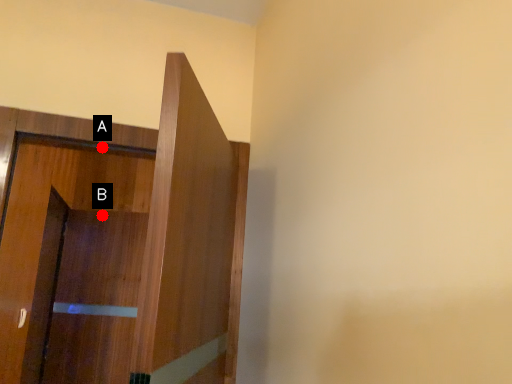
Question: Two points are circled on the image, labeled by A and B beside each circle. Which of the following is the farthest from the observer?

Choices:
 (A) A is further
 (B) B is further

Answer: (B)